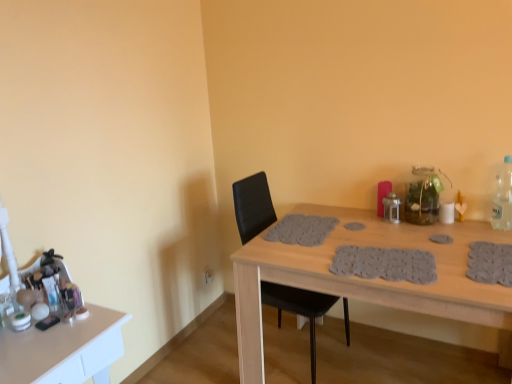
Question: From a real-world perspective, is white glossy makeup at left, the 1th table in the left-to-right sequence, positioned above or below black leather chair at center?

Choices:
 (A) above
 (B) below

Answer: (B)

Question: Considering the positions of white glossy makeup at left, arranged as the second table when viewed from the right, and black leather chair at center in the image, is white glossy makeup at left, arranged as the second table when viewed from the right, taller or shorter than black leather chair at center?

Choices:
 (A) short
 (B) tall

Answer: (A)

Question: Estimate the real-world distances between objects in this image. Which object is closer to the clear plastic bottle at right?

Choices:
 (A) wooden table at center, the first table positioned from the right
 (B) black leather chair at center
 (C) white glossy makeup at left, arranged as the second table when viewed from the right

Answer: (A)

Question: Which object is positioned closest to the wooden table at center, the second table positioned from the left?

Choices:
 (A) white glossy makeup at left, arranged as the second table when viewed from the right
 (B) clear plastic bottle at right
 (C) black leather chair at center

Answer: (C)